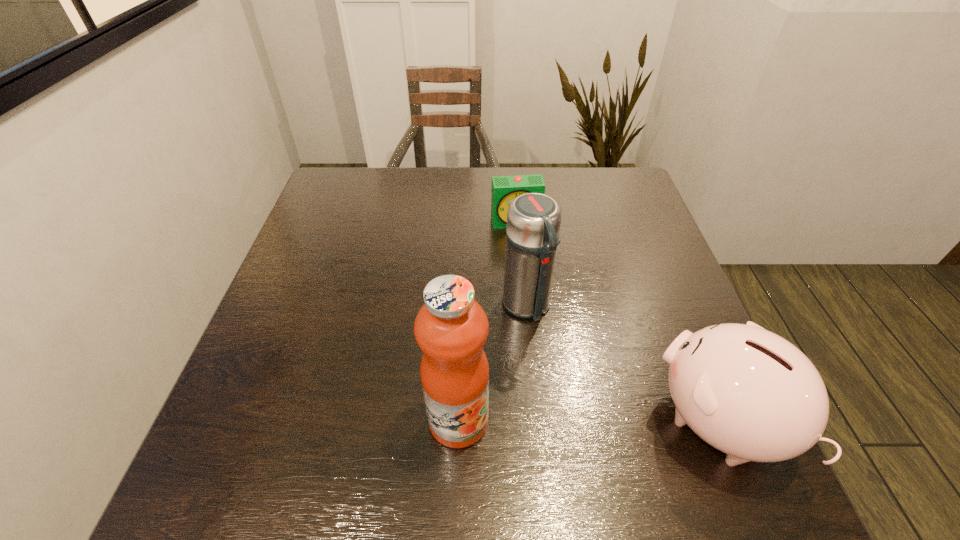
Find the location of a particular element. This screenshot has width=960, height=540. free space located 0.180m on the front-facing side of the shortest object is located at coordinates (531, 276).

Identify the location of vacant point located on the front-facing side of the shortest object. This screenshot has width=960, height=540. (526, 259).

Find the location of a particular element. The width and height of the screenshot is (960, 540). vacant space located 0.180m with a handle on the side of the thermos bottle is located at coordinates (580, 395).

Image resolution: width=960 pixels, height=540 pixels. What are the coordinates of `free location located 0.100m with a handle on the side of the thermos bottle` in the screenshot? It's located at (560, 362).

Image resolution: width=960 pixels, height=540 pixels. I want to click on vacant position located 0.180m with a handle on the side of the thermos bottle, so click(x=580, y=395).

Image resolution: width=960 pixels, height=540 pixels. What are the coordinates of `fruit juice located at the near edge` in the screenshot? It's located at (451, 328).

Where is `piggy bank that is at the near edge`? The width and height of the screenshot is (960, 540). piggy bank that is at the near edge is located at coordinates (748, 392).

This screenshot has height=540, width=960. I want to click on object at the right edge, so click(748, 392).

Find the location of `object that is positioned at the near right corner`. object that is positioned at the near right corner is located at coordinates (748, 392).

Where is `vacant space at the far edge of the desktop`? The image size is (960, 540). vacant space at the far edge of the desktop is located at coordinates (567, 194).